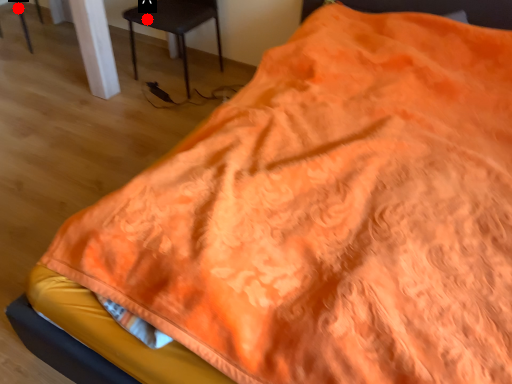
Question: Two points are circled on the image, labeled by A and B beside each circle. Which of the following is the farthest from the observer?

Choices:
 (A) A is further
 (B) B is further

Answer: (B)